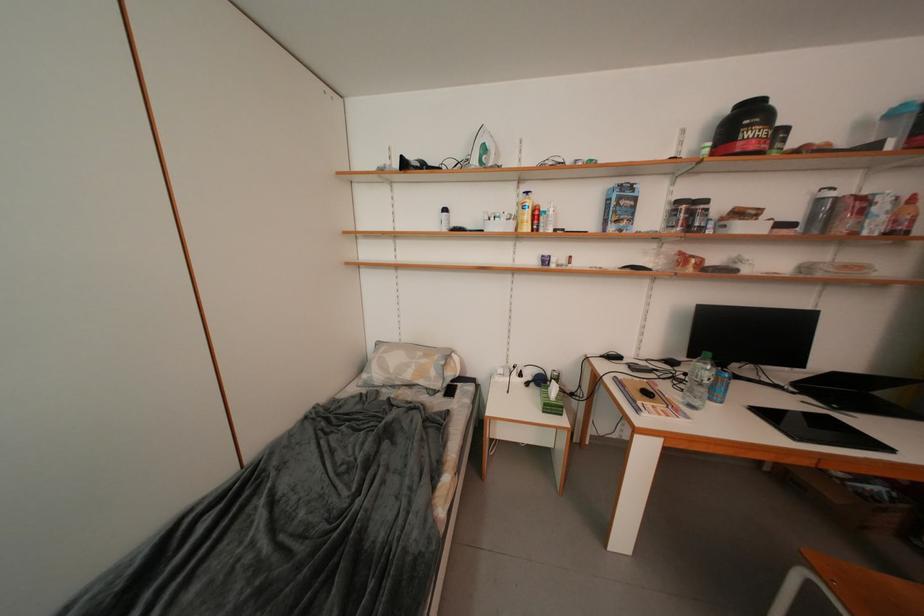
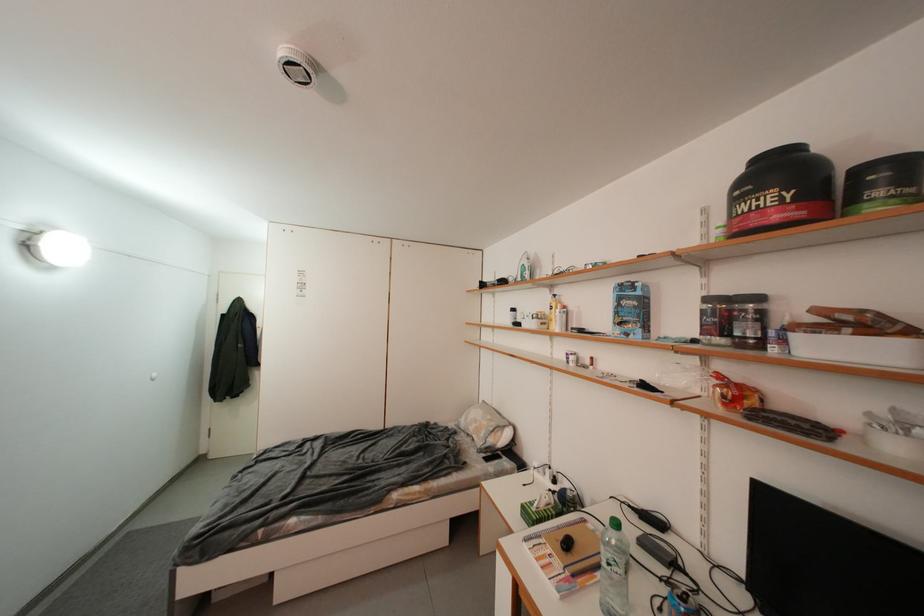
Find the pixel in the second image that matches (x=714, y=205) in the first image.

(766, 301)